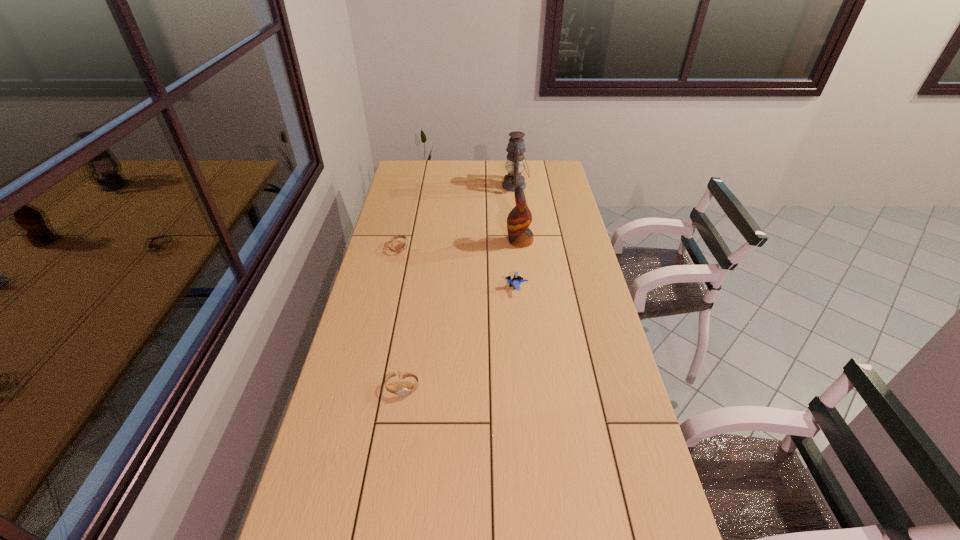
Where is `oil lamp`? This screenshot has height=540, width=960. oil lamp is located at coordinates (515, 163).

Where is `parrot`? Image resolution: width=960 pixels, height=540 pixels. parrot is located at coordinates (518, 221).

At what (x,y) coordinates should I click in order to perform the action: click on the second nearest object. Please return your answer as a coordinate pair (x, y). This screenshot has height=540, width=960. Looking at the image, I should click on (516, 280).

This screenshot has height=540, width=960. What are the coordinates of `the third tallest object` in the screenshot? It's located at (516, 280).

Where is `the left watch`? the left watch is located at coordinates (397, 236).

Where is `the farther watch`? The width and height of the screenshot is (960, 540). the farther watch is located at coordinates (397, 236).

This screenshot has width=960, height=540. In order to click on the nearer watch in this screenshot , I will do `click(402, 392)`.

I want to click on the right watch, so click(402, 392).

What are the coordinates of `vacant space situated 0.350m on the front of the oil lamp` in the screenshot? It's located at (521, 238).

You are a GUI agent. You are given a task and a screenshot of the screen. Output one action in this format:
    pyautogui.click(x=<x>, y=<y>)
    Task: Click on the free region located on the face of the parrot
    Image resolution: width=960 pixels, height=540 pixels.
    Given the screenshot: What is the action you would take?
    pyautogui.click(x=440, y=241)